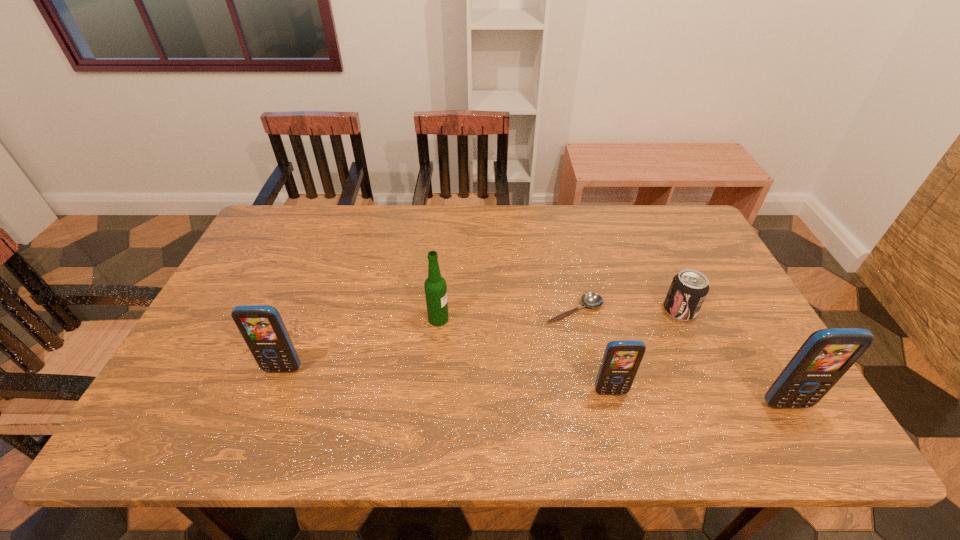
Find the location of `free space that is in between the ladle and the leftmost cellular telephone`. free space that is in between the ladle and the leftmost cellular telephone is located at coordinates click(x=428, y=340).

Identify which object is located as the fifth nearest to the soda can. Please provide its 2D coordinates. Your answer should be formatted as a tuple, i.e. [(x, y)], where the tuple contains the x and y coordinates of a point satisfying the conditions above.

[(262, 328)]

The image size is (960, 540). I want to click on object that is the third closest one to the leftmost object, so click(621, 360).

Identify which cellular telephone is the third nearest to the fifth object from right to left. Please provide its 2D coordinates. Your answer should be formatted as a tuple, i.e. [(x, y)], where the tuple contains the x and y coordinates of a point satisfying the conditions above.

[(827, 354)]

Choose which cellular telephone is the second nearest neighbor to the second object from right to left. Please provide its 2D coordinates. Your answer should be formatted as a tuple, i.e. [(x, y)], where the tuple contains the x and y coordinates of a point satisfying the conditions above.

[(621, 360)]

Find the location of a particular element. The image size is (960, 540). vacant area in the image that satisfies the following two spatial constraints: 1. on the label of the beer bottle; 2. on the screen of the leftmost cellular telephone is located at coordinates (434, 369).

Locate an element on the screen. The image size is (960, 540). vacant space that satisfies the following two spatial constraints: 1. on the label of the fifth object from right to left; 2. on the screen of the leftmost object is located at coordinates (434, 369).